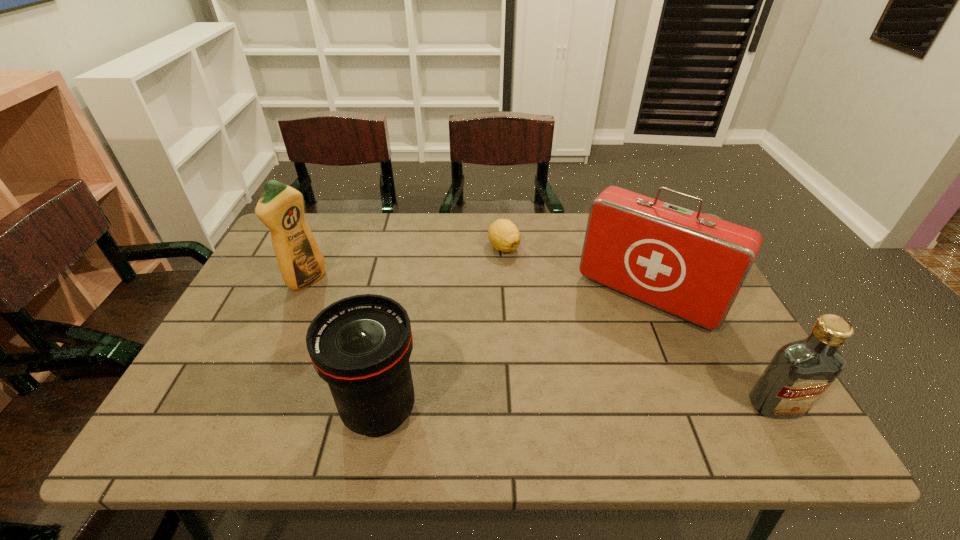
Identify the location of free spot on the desktop that is between the telephoto lens and the vodka and is positioned on the label of the detergent. The image size is (960, 540). (552, 408).

You are a GUI agent. You are given a task and a screenshot of the screen. Output one action in this format:
    pyautogui.click(x=<x>, y=<y>)
    Task: Click on the vacant space on the desktop that is between the telephoto lens and the vodka and is positioned on the side of the first-aid kit with the first aid cross symbol
    Image resolution: width=960 pixels, height=540 pixels.
    Given the screenshot: What is the action you would take?
    pyautogui.click(x=574, y=408)

Image resolution: width=960 pixels, height=540 pixels. I want to click on free space on the desktop that is between the fourth object from right to left and the vodka and is positioned at the stem end of the third object from left to right, so (533, 408).